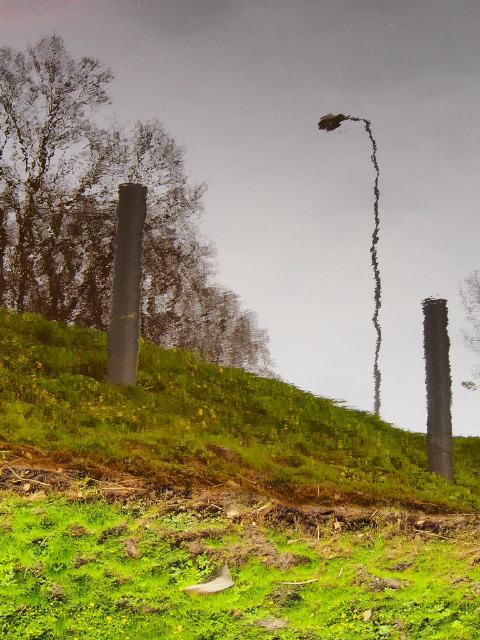
You are standing in the middle of the grassy area and want to take a photo of both point (476,628) and point (425,333). Which point should you focus on first to ensure both are in sharp focus?

You should focus on point (425,333) first because it is farther from the camera than point (476,628). By focusing on the farther point, the depth of field will include the closer point as well, ensuring both are in sharp focus.

You are standing at the edge of the water and want to step onto the green mossy ground at lower center and then walk towards the smooth gray pole at right. Which direction should you move relative to the pole?

You should move to the left relative to the smooth gray pole at right because the green mossy ground at lower center is located to the left of the smooth gray pole at right.

You are standing at the smooth black pole at center and want to walk to the other side of the field. There is a muddy area between them. Can you safely walk directly between the two poles without stepping into the muddy area?

The two poles are 11.44 meters apart. Since the muddy area is between them, you can walk directly between the two poles as long as you stay on the grassy patches, avoiding the muddy sections. However, the distance is quite large, so caution is advised.